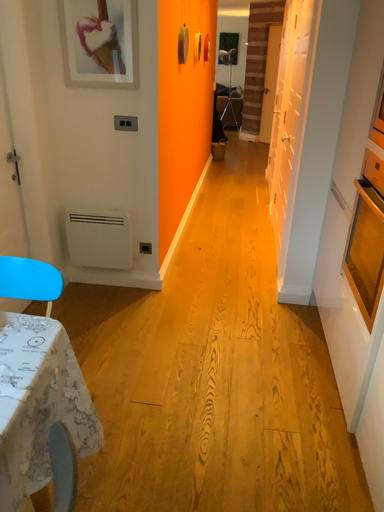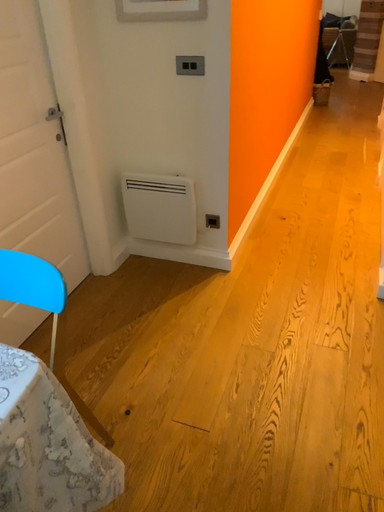
Question: Which way did the camera rotate in the video?

Choices:
 (A) rotated downward
 (B) rotated upward

Answer: (A)